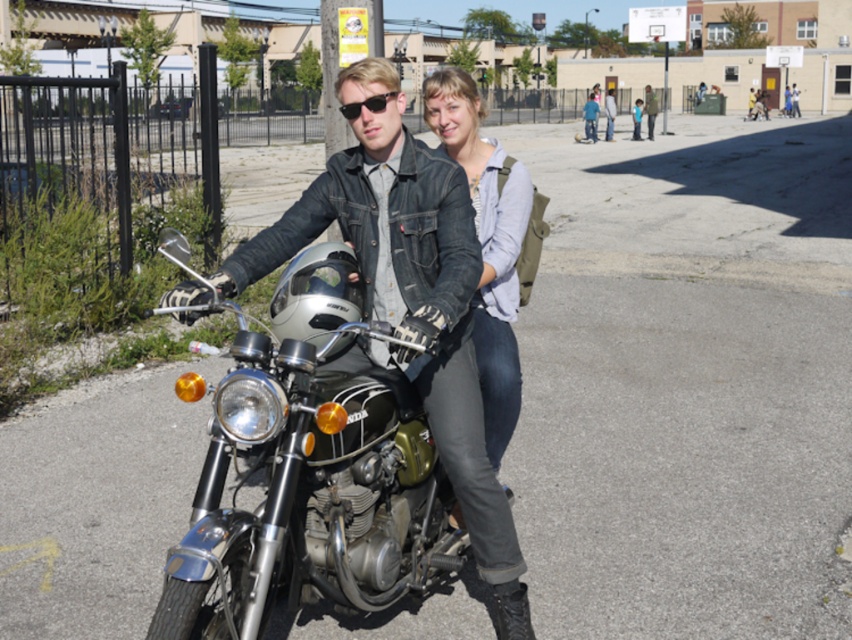
You are standing at the point with coordinates (486, 244) in the image. What object are you standing on?

You are standing on the denim jacket at center.

You are a photographer trying to capture a shot of the shiny chrome motorcycle at center and the black matte sunglasses at center. Based on their positions, which object is closer to the camera?

The shiny chrome motorcycle at center is located below the black matte sunglasses at center, so the black matte sunglasses at center is closer to the camera.